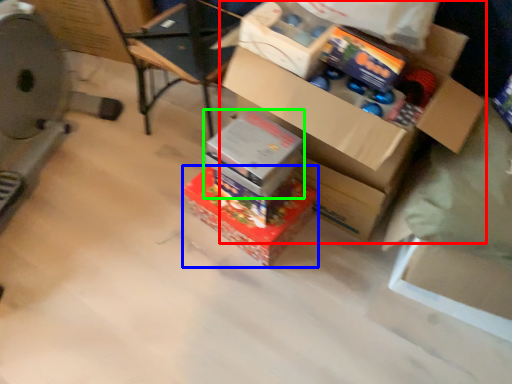
Question: Which is farther away from box (highlighted by a red box)? box (highlighted by a blue box) or box (highlighted by a green box)?

Choices:
 (A) box
 (B) box

Answer: (A)